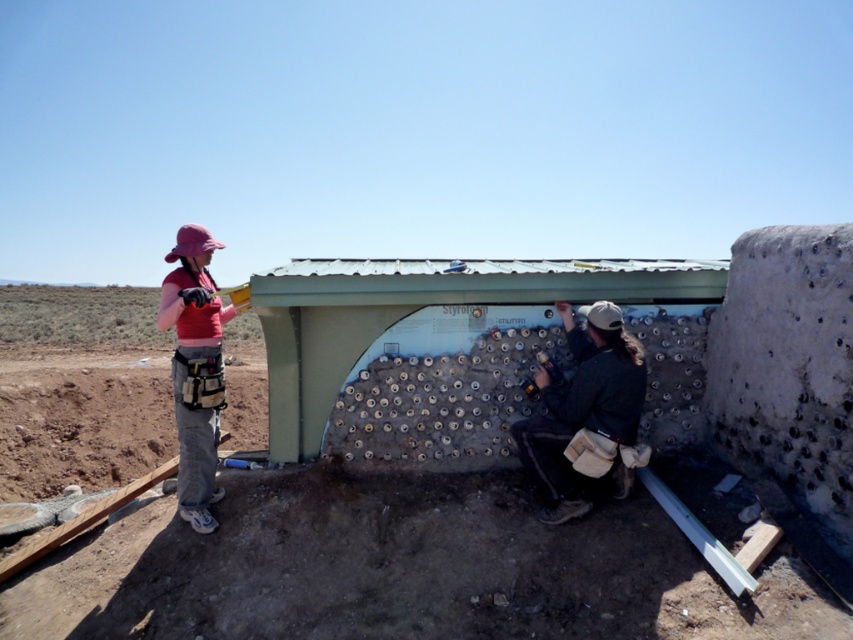
Question: Does dark green jacket at center appear over pink fabric construction worker at left?

Choices:
 (A) no
 (B) yes

Answer: (A)

Question: Which object is closer to the camera taking this photo?

Choices:
 (A) pink fabric construction worker at left
 (B) dark green jacket at center

Answer: (A)

Question: Which of the following is the farthest from the observer?

Choices:
 (A) pos(521,426)
 (B) pos(200,493)

Answer: (B)

Question: Which of the following is the farthest from the observer?

Choices:
 (A) pink fabric construction worker at left
 (B) textured concrete wall at center

Answer: (A)

Question: Is textured concrete wall at center positioned behind pink fabric construction worker at left?

Choices:
 (A) no
 (B) yes

Answer: (A)

Question: Is textured concrete wall at center positioned before dark green jacket at center?

Choices:
 (A) yes
 (B) no

Answer: (A)